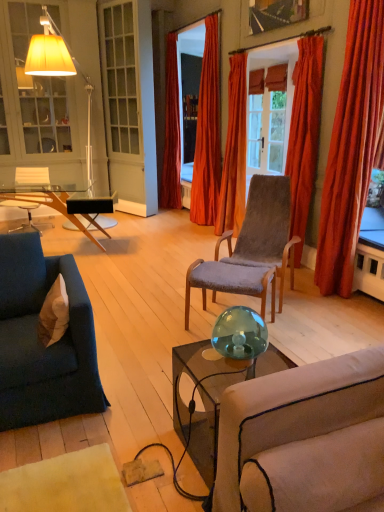
Question: Is white fabric pillow at lower left located within velvet orange curtain at upper right, which is counted as the fourth curtain, starting from the left?

Choices:
 (A) yes
 (B) no

Answer: (B)

Question: From the image's perspective, is velvet orange curtain at upper right, which is counted as the fourth curtain, starting from the left, located beneath white fabric pillow at lower left?

Choices:
 (A) yes
 (B) no

Answer: (B)

Question: Is velvet orange curtain at upper right, the second curtain from the right, closer to the viewer compared to white fabric pillow at lower left?

Choices:
 (A) yes
 (B) no

Answer: (B)

Question: Is velvet orange curtain at upper right, the second curtain from the right, smaller than white fabric pillow at lower left?

Choices:
 (A) yes
 (B) no

Answer: (B)

Question: Does velvet orange curtain at upper right, which is counted as the fourth curtain, starting from the left, have a larger size compared to white fabric pillow at lower left?

Choices:
 (A) yes
 (B) no

Answer: (A)

Question: In terms of width, does matte glass window screen at upper right look wider or thinner when compared to orange velvet curtain at upper center, which is counted as the 4th curtain, starting from the right?

Choices:
 (A) wide
 (B) thin

Answer: (B)

Question: Looking at the image, does matte glass window screen at upper right seem bigger or smaller compared to orange velvet curtain at upper center, which is counted as the 4th curtain, starting from the right?

Choices:
 (A) small
 (B) big

Answer: (A)

Question: From their relative heights in the image, would you say matte glass window screen at upper right is taller or shorter than orange velvet curtain at upper center, acting as the second curtain starting from the left?

Choices:
 (A) short
 (B) tall

Answer: (A)

Question: Would you say matte glass window screen at upper right is inside or outside orange velvet curtain at upper center, acting as the second curtain starting from the left?

Choices:
 (A) inside
 (B) outside

Answer: (B)

Question: Looking at their shapes, would you say white fabric pillow at lower left is wider or thinner than velvet orange curtain at upper right, which is counted as the fourth curtain, starting from the left?

Choices:
 (A) thin
 (B) wide

Answer: (A)

Question: In terms of height, does white fabric pillow at lower left look taller or shorter compared to velvet orange curtain at upper right, which is counted as the fourth curtain, starting from the left?

Choices:
 (A) tall
 (B) short

Answer: (B)

Question: From a real-world perspective, is white fabric pillow at lower left physically located above or below velvet orange curtain at upper right, which is counted as the fourth curtain, starting from the left?

Choices:
 (A) below
 (B) above

Answer: (A)

Question: Considering the relative positions of white fabric pillow at lower left and velvet orange curtain at upper right, which is counted as the fourth curtain, starting from the left, in the image provided, is white fabric pillow at lower left to the left or to the right of velvet orange curtain at upper right, which is counted as the fourth curtain, starting from the left,?

Choices:
 (A) right
 (B) left

Answer: (B)

Question: Is velvet blue couch at left inside or outside of white fabric pillow at lower left?

Choices:
 (A) inside
 (B) outside

Answer: (B)

Question: Is point (52, 282) positioned closer to the camera than point (54, 292)?

Choices:
 (A) farther
 (B) closer

Answer: (A)